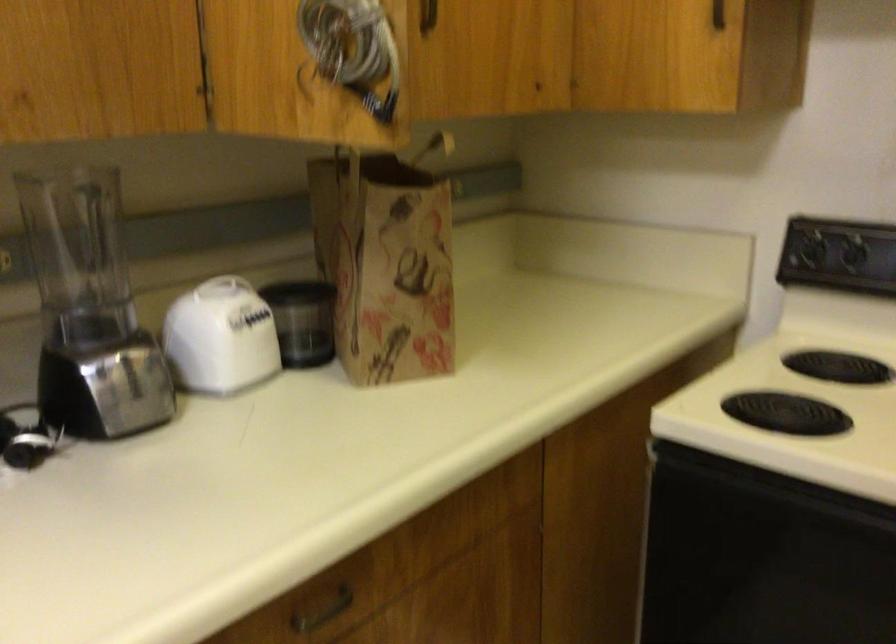
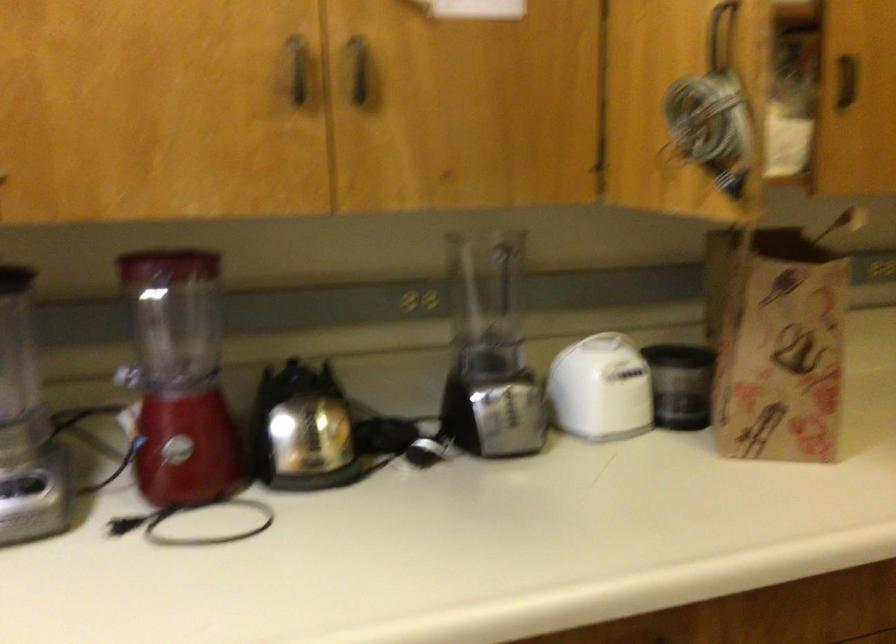
Question: The camera is either moving clockwise (left) or counter-clockwise (right) around the object. The first image is from the beginning of the video and the second image is from the end. Is the camera moving left or right when shooting the video?

Choices:
 (A) Left
 (B) Right

Answer: (B)